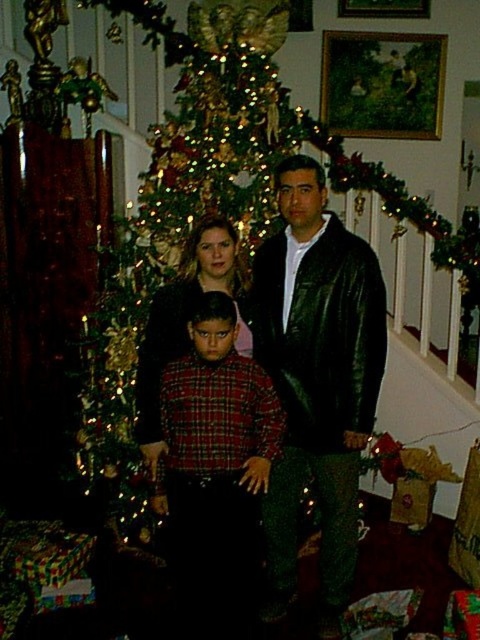
Question: Which object is closer to the camera taking this photo?

Choices:
 (A) wooden framed painting at upper center
 (B) shiny black leather jacket at center
 (C) plaid shirt at center
 (D) matte black sweater at center

Answer: (C)

Question: From the image, what is the correct spatial relationship of shiny black leather jacket at center in relation to wooden framed painting at upper center?

Choices:
 (A) below
 (B) above

Answer: (A)

Question: Which of these objects is positioned closest to the wooden framed painting at upper center?

Choices:
 (A) matte black sweater at center
 (B) plaid shirt at center

Answer: (A)

Question: Which of the following is the closest to the observer?

Choices:
 (A) matte black sweater at center
 (B) plaid shirt at center

Answer: (B)

Question: Can you confirm if shiny black leather jacket at center is thinner than matte black sweater at center?

Choices:
 (A) yes
 (B) no

Answer: (B)

Question: In this image, where is wooden framed painting at upper center located relative to matte black sweater at center?

Choices:
 (A) right
 (B) left

Answer: (A)